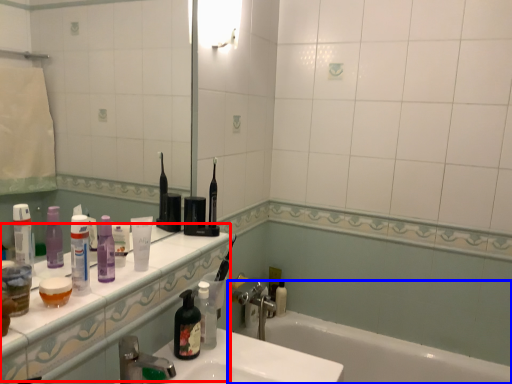
Question: Which point is further to the camera, counter top (highlighted by a red box) or bathtub (highlighted by a blue box)?

Choices:
 (A) counter top
 (B) bathtub

Answer: (B)